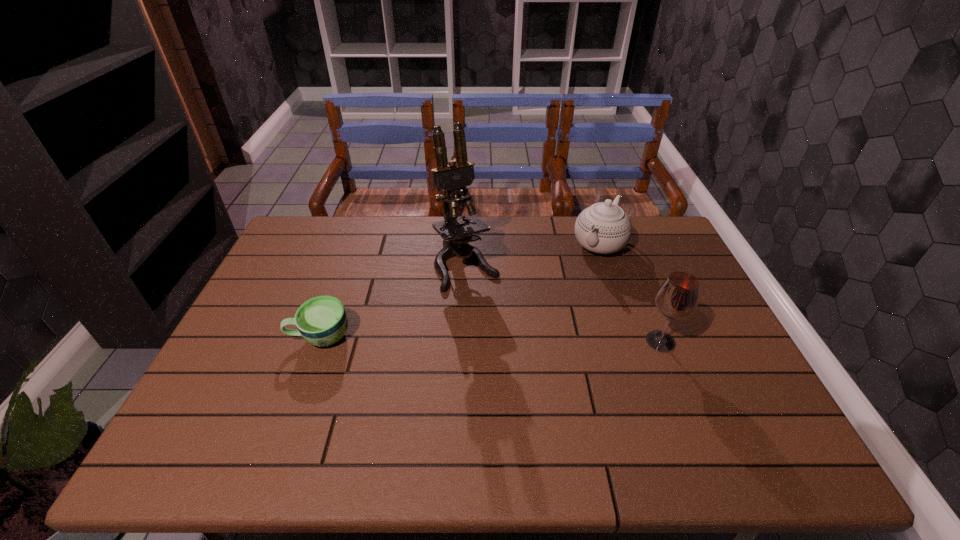
Locate an element on the screen. Image resolution: width=960 pixels, height=540 pixels. the shortest object is located at coordinates (322, 321).

Identify the location of cup. (322, 321).

Find the location of a particular element. This screenshot has width=960, height=540. the third shortest object is located at coordinates (677, 298).

In order to click on chinaware in this screenshot , I will do pos(604,228).

Find the location of a particular element. microscope is located at coordinates (456, 232).

You are a GUI agent. You are given a task and a screenshot of the screen. Output one action in this format:
    pyautogui.click(x=<x>, y=<y>)
    Task: Click on the second object from left to right
    
    Given the screenshot: What is the action you would take?
    point(456,232)

Locate an element on the screen. This screenshot has height=540, width=960. vacant region located on the right of the leftmost object is located at coordinates (495, 336).

What are the coordinates of `vacant space situated 0.110m on the left of the second tallest object` in the screenshot? It's located at (601, 341).

Find the location of a particular element. Image resolution: width=960 pixels, height=540 pixels. free space located 0.120m on the spout of the chinaware is located at coordinates (573, 282).

Where is `free space located on the spout of the chinaware`? The width and height of the screenshot is (960, 540). free space located on the spout of the chinaware is located at coordinates [x=540, y=326].